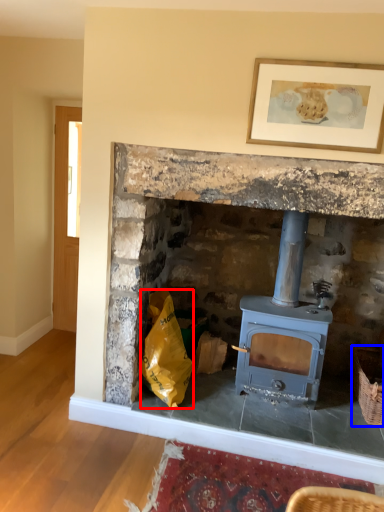
Question: Among these objects, which one is farthest to the camera, material (highlighted by a red box) or basket (highlighted by a blue box)?

Choices:
 (A) material
 (B) basket

Answer: (B)